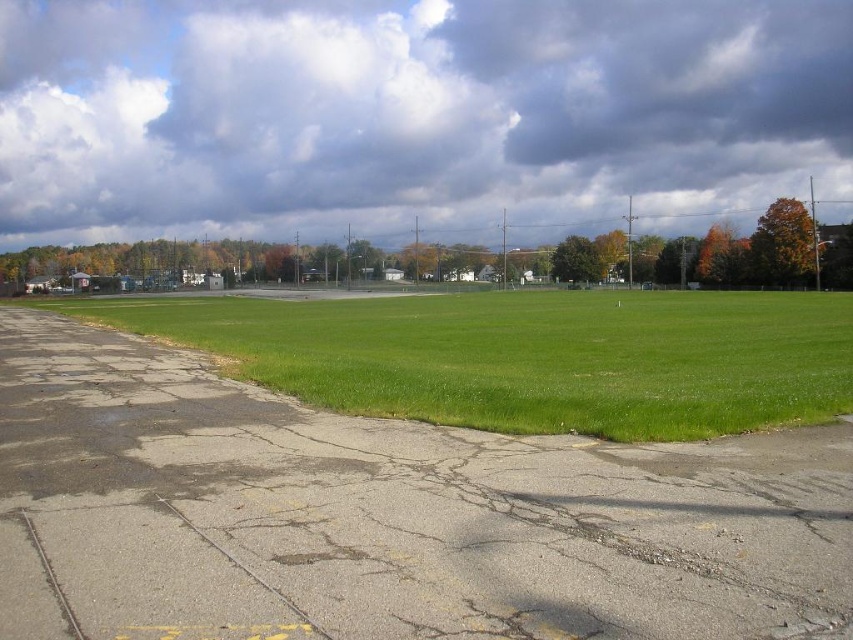
Is cloudy sky at upper smaller than green grass at center?

A: No, cloudy sky at upper is not smaller than green grass at center.

Describe the element at coordinates (413, 115) in the screenshot. The width and height of the screenshot is (853, 640). I see `cloudy sky at upper` at that location.

At what (x,y) coordinates should I click in order to perform the action: click on cloudy sky at upper. Please return your answer as a coordinate pair (x, y). Looking at the image, I should click on (413, 115).